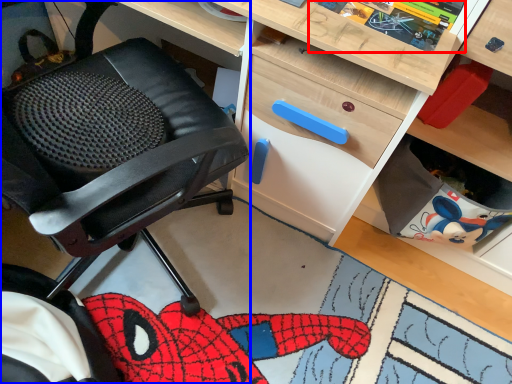
Question: Which object appears closest to the camera in this image, comic book (highlighted by a red box) or chair (highlighted by a blue box)?

Choices:
 (A) comic book
 (B) chair

Answer: (B)